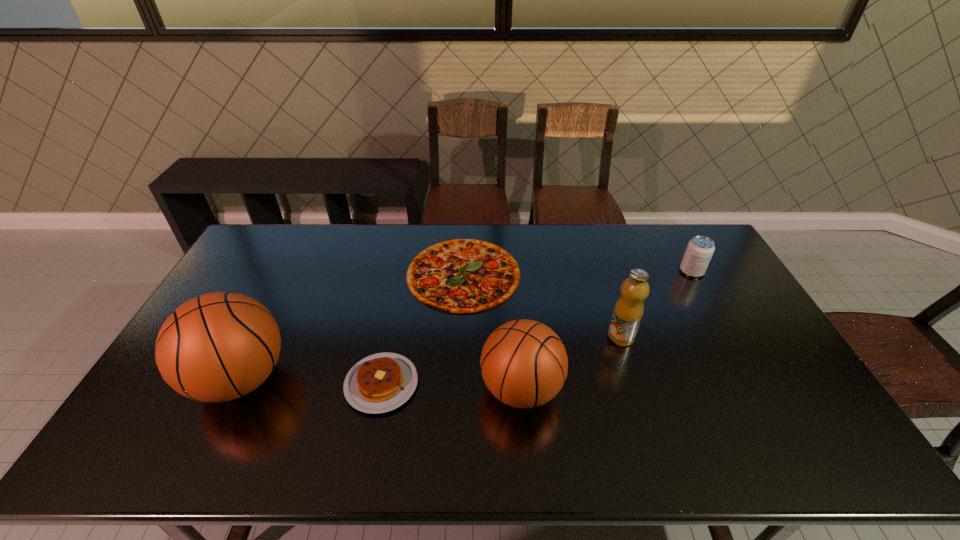
Find the location of a particular element. This screenshot has height=540, width=960. vacant space that's between the fourth tallest object and the fifth object from left to right is located at coordinates (656, 304).

Where is `unoccupied area between the pancake and the left basketball`? unoccupied area between the pancake and the left basketball is located at coordinates (311, 381).

You are a GUI agent. You are given a task and a screenshot of the screen. Output one action in this format:
    pyautogui.click(x=<x>, y=<y>)
    Task: Click on the free space between the pancake and the shortest object
    The width and height of the screenshot is (960, 540).
    Given the screenshot: What is the action you would take?
    [422, 329]

I want to click on vacant area between the fifth object from left to right and the third shortest object, so click(x=656, y=304).

Locate an element on the screen. Image resolution: width=960 pixels, height=540 pixels. object that ranks as the third closest to the right basketball is located at coordinates (461, 276).

Point out which object is positioned as the fifth nearest to the second shortest object. Please provide its 2D coordinates. Your answer should be formatted as a tuple, i.e. [(x, y)], where the tuple contains the x and y coordinates of a point satisfying the conditions above.

[(699, 251)]

At what (x,y) coordinates should I click in order to perform the action: click on free spot that satisfies the following two spatial constraints: 1. on the back side of the shorter basketball; 2. on the right side of the rightmost object. Please return your answer as a coordinate pair (x, y). This screenshot has width=960, height=540. Looking at the image, I should click on (512, 271).

The image size is (960, 540). Find the location of `free spot that satisfies the following two spatial constraints: 1. on the front side of the right basketball; 2. on the left side of the shortest object`. free spot that satisfies the following two spatial constraints: 1. on the front side of the right basketball; 2. on the left side of the shortest object is located at coordinates (459, 389).